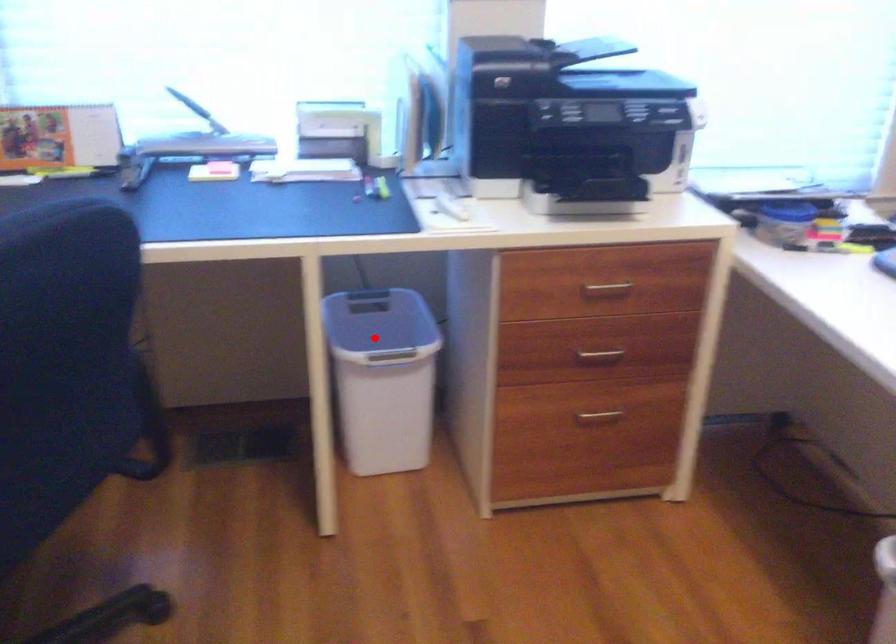
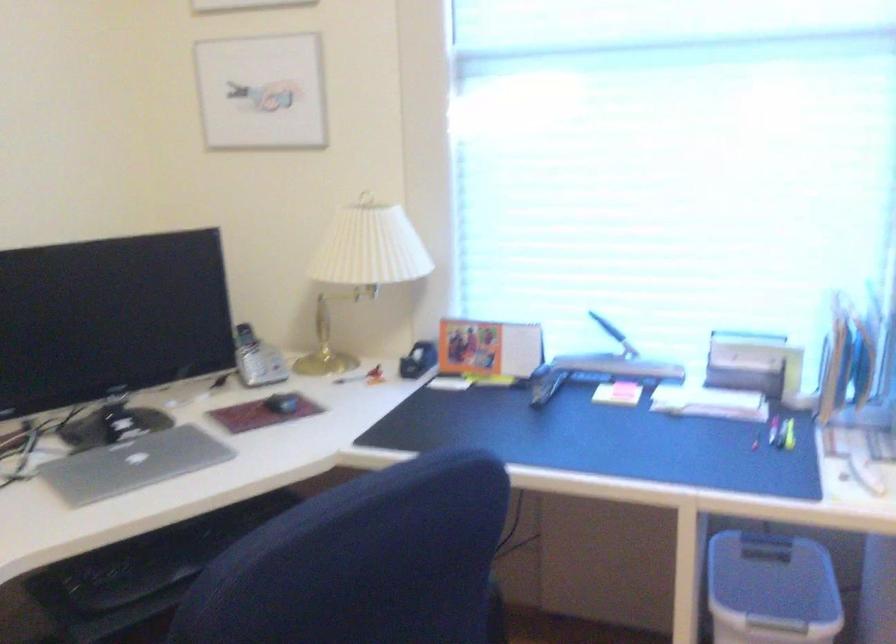
The point at the highlighted location is marked in the first image. Where is the corresponding point in the second image?

(771, 589)